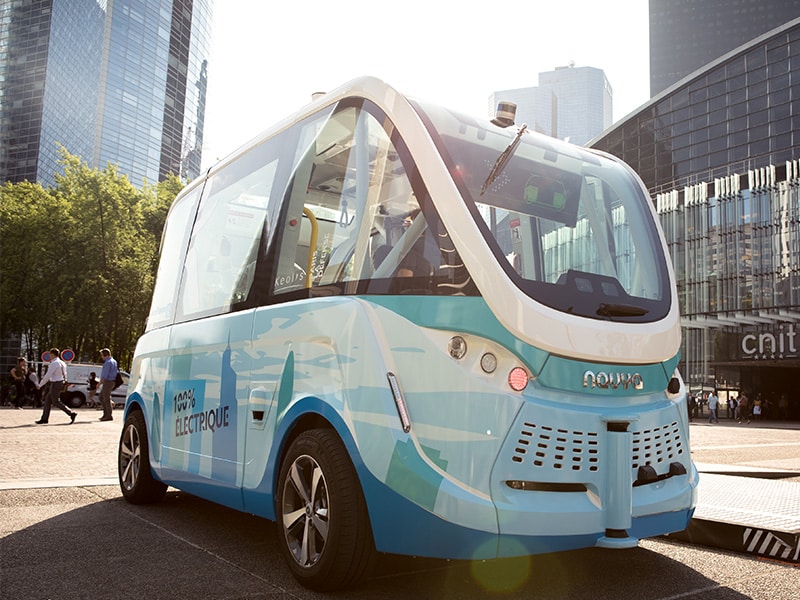
Identify the location of vents. (550, 446), (658, 445).